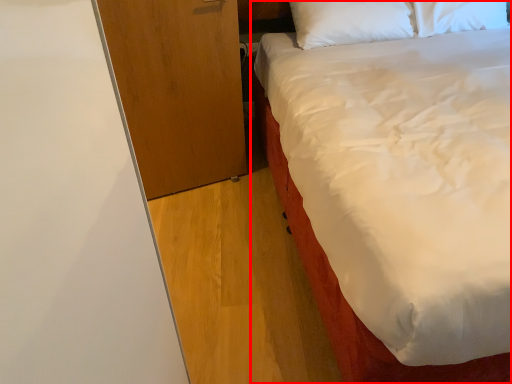
Question: Considering the relative positions of bed (annotated by the red box) and dresser in the image provided, where is bed (annotated by the red box) located with respect to the staircase?

Choices:
 (A) right
 (B) left

Answer: (A)